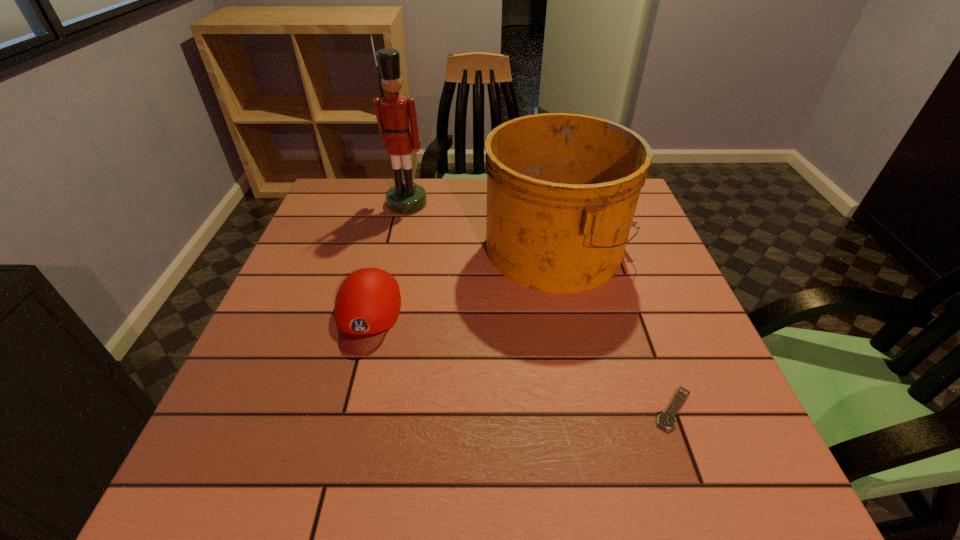
Where is `the tallest object`? the tallest object is located at coordinates (393, 112).

Locate an element on the screen. The width and height of the screenshot is (960, 540). bucket is located at coordinates (562, 189).

Identify the location of baseball cap. This screenshot has height=540, width=960. (368, 302).

You are a GUI agent. You are given a task and a screenshot of the screen. Output one action in this format:
    pyautogui.click(x=<x>, y=<y>)
    Task: Click on the nearest object
    The height and width of the screenshot is (540, 960).
    Given the screenshot: What is the action you would take?
    pyautogui.click(x=667, y=420)

Where is `watch`? watch is located at coordinates (667, 420).

Find the location of a particular element. Image resolution: width=960 pixels, height=540 pixels. free space located 0.150m on the front-facing side of the tallest object is located at coordinates (397, 247).

The width and height of the screenshot is (960, 540). In order to click on vacant space located on the left of the bucket in this screenshot , I will do `click(461, 247)`.

At what (x,y) coordinates should I click in order to perform the action: click on vacant space located on the front-facing side of the second shortest object. Please return your answer as a coordinate pair (x, y). This screenshot has width=960, height=540. Looking at the image, I should click on (331, 456).

This screenshot has width=960, height=540. Identify the location of vacant space situated 0.090m on the front of the nearest object. (702, 487).

Find the location of a particular element. The image size is (960, 540). nutcracker that is at the far edge is located at coordinates (393, 112).